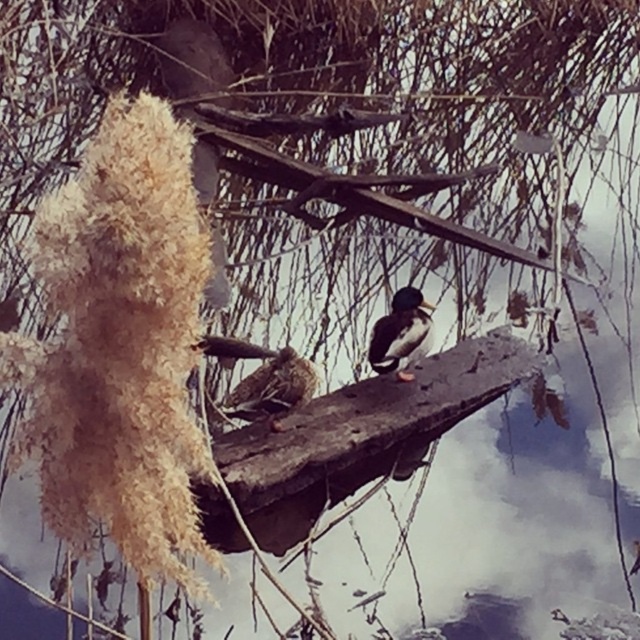
You are an ornithologist observing the ducks in the winter scene. You notice a set of brown speckled feathers at center. Can you determine the exact coordinates of these feathers?

The brown speckled feathers at center are located at coordinates point (273, 388).

You are an ornithologist observing the ducks in the winter scene. You notice two objects labeled brown speckled feathers at center and shiny brown duck at center. Which of these two objects has a greater width?

The brown speckled feathers at center has a greater width than the shiny brown duck at center according to the description.

You are an ornithologist observing the ducks in the winter scene. You notice two features on the log. Which of the two, the brown speckled feathers at center or the shiny brown duck at center, is positioned lower in the image?

The brown speckled feathers at center is located below the shiny brown duck at center, so it is positioned lower in the image.